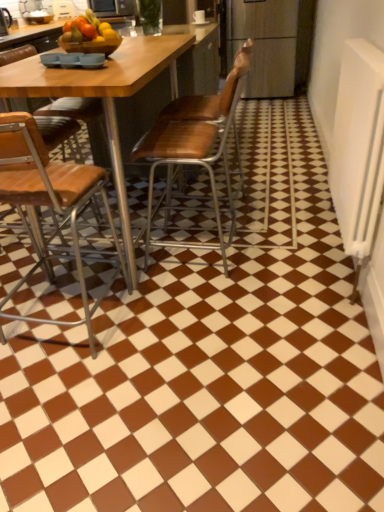
Question: Is point (31, 139) closer or farther from the camera than point (208, 117)?

Choices:
 (A) closer
 (B) farther

Answer: (A)

Question: Choose the correct answer: Is brown leather chair at left, positioned as the 1th chair in left-to-right order, inside wooden seat at center, which appears as the 1th chair when viewed from the right, or outside it?

Choices:
 (A) outside
 (B) inside

Answer: (A)

Question: Which of these objects is positioned closest to the metallic microwave at upper center?

Choices:
 (A) brown leather chair at left, positioned as the 1th chair in left-to-right order
 (B) wooden seat at center, which is counted as the 3th chair, starting from the left
 (C) wooden at center, which ranks as the second chair in left-to-right order

Answer: (C)

Question: Which is nearer to the brown leather chair at left, acting as the third chair starting from the right?

Choices:
 (A) metallic microwave at upper center
 (B) wooden seat at center, which is counted as the 3th chair, starting from the left
 (C) wooden at center, the 2th chair from the right

Answer: (C)